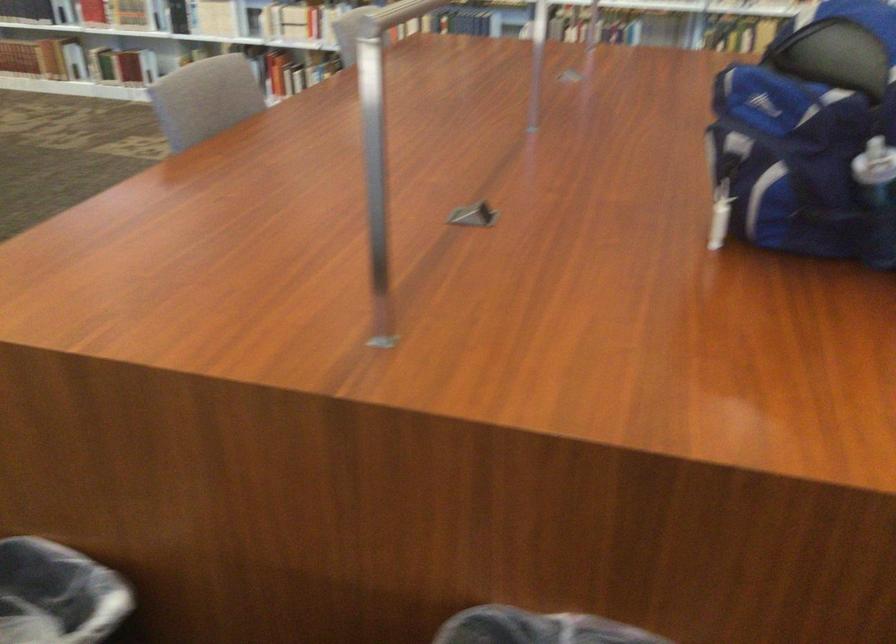
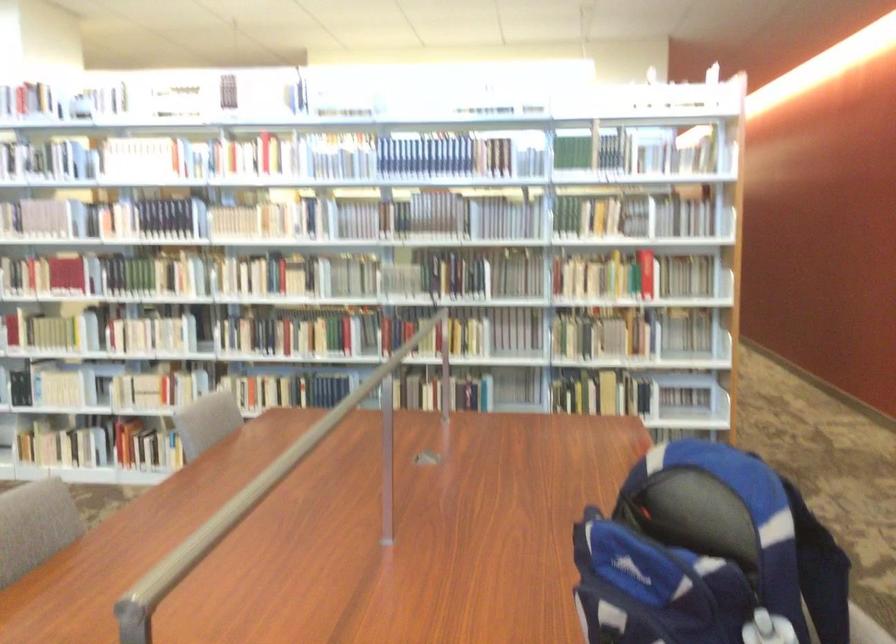
Question: The first image is from the beginning of the video and the second image is from the end. How did the camera likely rotate when shooting the video?

Choices:
 (A) Left
 (B) Right
 (C) Up
 (D) Down

Answer: (C)